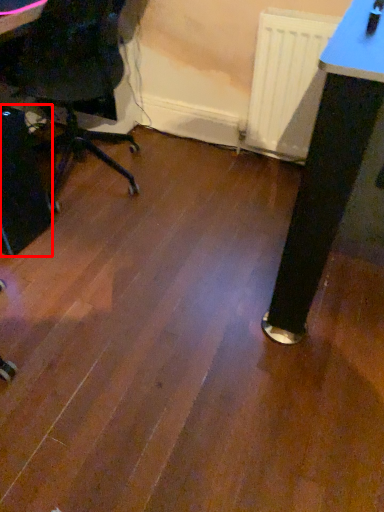
Question: From the image's perspective, considering the relative positions of computer tower (annotated by the red box) and radiator in the image provided, where is computer tower (annotated by the red box) located with respect to the staircase?

Choices:
 (A) above
 (B) below

Answer: (B)